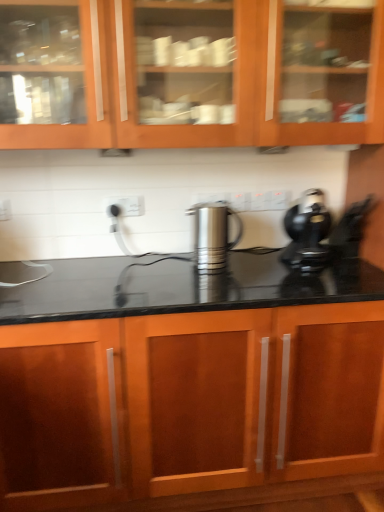
Question: Is wooden cabinet at upper center, the second cabinetry when ordered from bottom to top, positioned beyond the bounds of black plastic coffee maker at right?

Choices:
 (A) yes
 (B) no

Answer: (A)

Question: Can you confirm if wooden cabinet at upper center, marked as the 1th cabinetry in a top-to-bottom arrangement, is bigger than black plastic coffee maker at right?

Choices:
 (A) yes
 (B) no

Answer: (A)

Question: From the image's perspective, is wooden cabinet at upper center, marked as the 1th cabinetry in a top-to-bottom arrangement, above black plastic coffee maker at right?

Choices:
 (A) yes
 (B) no

Answer: (A)

Question: Is wooden cabinet at upper center, marked as the 1th cabinetry in a top-to-bottom arrangement, beside black plastic coffee maker at right?

Choices:
 (A) no
 (B) yes

Answer: (A)

Question: Can you confirm if wooden cabinet at upper center, marked as the 1th cabinetry in a top-to-bottom arrangement, is shorter than black plastic coffee maker at right?

Choices:
 (A) no
 (B) yes

Answer: (A)

Question: Do you think black plastic coffee maker at right is within wooden cabinet at upper center, the second cabinetry when ordered from bottom to top, or outside of it?

Choices:
 (A) outside
 (B) inside

Answer: (A)

Question: In terms of width, does black plastic coffee maker at right look wider or thinner when compared to wooden cabinet at upper center, marked as the 1th cabinetry in a top-to-bottom arrangement?

Choices:
 (A) wide
 (B) thin

Answer: (A)

Question: Based on their sizes in the image, would you say black plastic coffee maker at right is bigger or smaller than wooden cabinet at upper center, marked as the 1th cabinetry in a top-to-bottom arrangement?

Choices:
 (A) small
 (B) big

Answer: (A)

Question: Is black plastic coffee maker at right taller or shorter than wooden cabinet at upper center, the second cabinetry when ordered from bottom to top?

Choices:
 (A) short
 (B) tall

Answer: (A)

Question: Does point (342, 102) appear closer or farther from the camera than point (307, 245)?

Choices:
 (A) closer
 (B) farther

Answer: (B)

Question: Based on their sizes in the image, would you say wooden cabinet at upper center, marked as the 1th cabinetry in a top-to-bottom arrangement, is bigger or smaller than black plastic coffee maker at right?

Choices:
 (A) big
 (B) small

Answer: (A)

Question: Do you think wooden cabinet at upper center, the second cabinetry when ordered from bottom to top, is within black plastic coffee maker at right, or outside of it?

Choices:
 (A) outside
 (B) inside

Answer: (A)

Question: Considering their positions, is wooden cabinet at upper center, marked as the 1th cabinetry in a top-to-bottom arrangement, located in front of or behind black plastic coffee maker at right?

Choices:
 (A) behind
 (B) front

Answer: (B)

Question: From a real-world perspective, is black plastic coffee maker at right positioned above or below satin silver kettle at center?

Choices:
 (A) above
 (B) below

Answer: (A)

Question: Considering the positions of point (304, 232) and point (193, 241), is point (304, 232) closer or farther from the camera than point (193, 241)?

Choices:
 (A) closer
 (B) farther

Answer: (A)